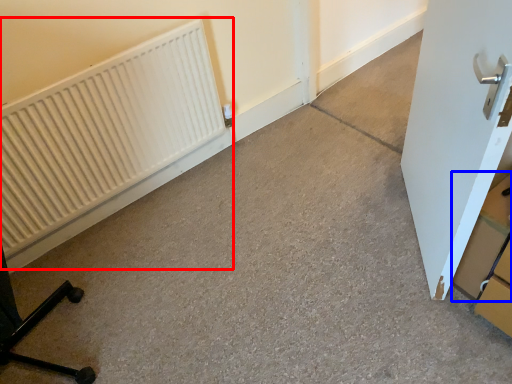
Question: Among these objects, which one is nearest to the camera, radiator (highlighted by a red box) or cardboard box (highlighted by a blue box)?

Choices:
 (A) radiator
 (B) cardboard box

Answer: (B)